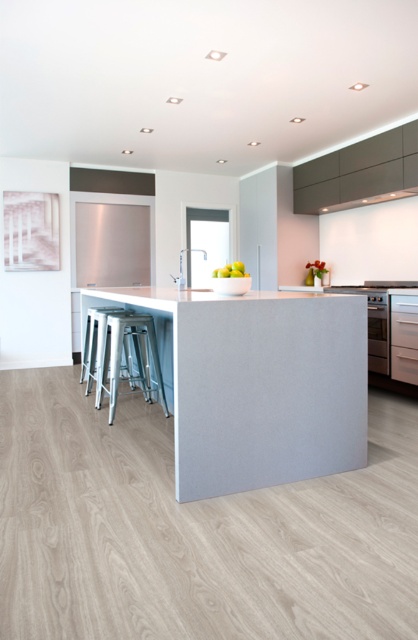
Consider the image. Does metallic silver bar stool at lower left appear over satin silver metallic exhaust hood at upper right?

No, metallic silver bar stool at lower left is not above satin silver metallic exhaust hood at upper right.

Who is more forward, (129, 316) or (362, 202)?

Positioned in front is point (129, 316).

Where is `metallic silver bar stool at lower left`? The width and height of the screenshot is (418, 640). metallic silver bar stool at lower left is located at coordinates (127, 356).

This screenshot has height=640, width=418. I want to click on metallic silver bar stool at lower left, so click(x=127, y=356).

Who is taller, matte gray countertop at center or metallic silver bar stool at lower left?

With more height is matte gray countertop at center.

Identify the location of matte gray countertop at center. (257, 384).

You are a GUI agent. You are given a task and a screenshot of the screen. Output one action in this format:
    pyautogui.click(x=<x>, y=<y>)
    Task: Click on the matte gray countertop at center
    This screenshot has height=640, width=418.
    Given the screenshot: What is the action you would take?
    pyautogui.click(x=257, y=384)

Which of these two, satin silver oven at center-right or satin silver metallic exhaust hood at upper right, stands taller?

With more height is satin silver oven at center-right.

Between satin silver oven at center-right and satin silver metallic exhaust hood at upper right, which one has less height?

satin silver metallic exhaust hood at upper right

Is point (384, 369) farther from viewer compared to point (338, 202)?

No, (384, 369) is closer to viewer.

The image size is (418, 640). I want to click on satin silver oven at center-right, so click(x=374, y=324).